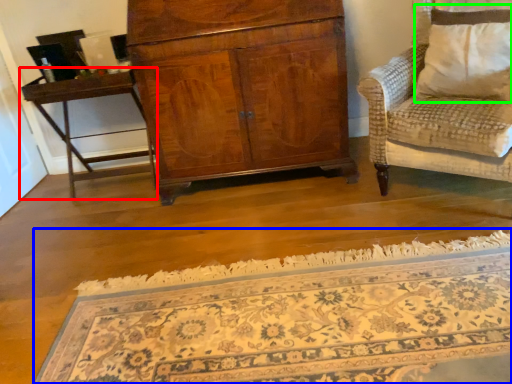
Question: Based on their relative distances, which object is farther from table (highlighted by a red box)? Choose from mat (highlighted by a blue box) and pillow (highlighted by a green box).

Choices:
 (A) mat
 (B) pillow

Answer: (B)